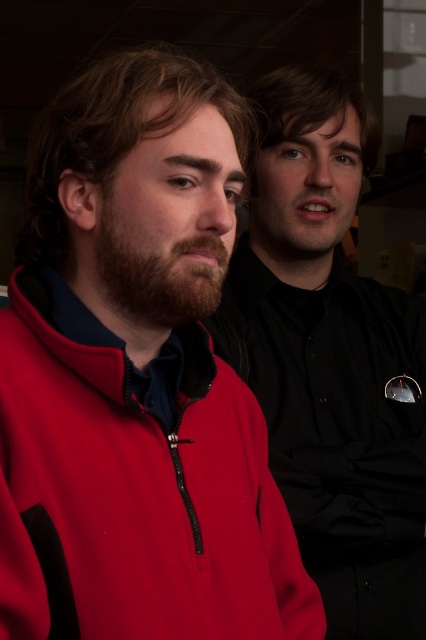
Question: Which point is closer to the camera?

Choices:
 (A) (388, 556)
 (B) (141, 467)

Answer: (B)

Question: Is matte fleece jacket at left smaller than matte red jacket at left?

Choices:
 (A) yes
 (B) no

Answer: (A)

Question: Is matte fleece jacket at left positioned before matte red jacket at left?

Choices:
 (A) no
 (B) yes

Answer: (B)

Question: Is matte fleece jacket at left further to camera compared to matte red jacket at left?

Choices:
 (A) yes
 (B) no

Answer: (B)